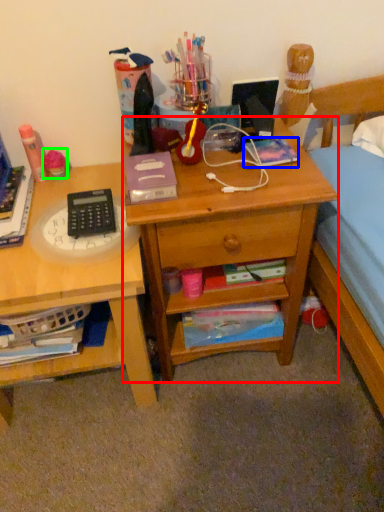
Question: Based on their relative distances, which object is nearer to desk (highlighted by a red box)? Choose from paperback book (highlighted by a blue box) and stationery (highlighted by a green box).

Choices:
 (A) paperback book
 (B) stationery

Answer: (A)